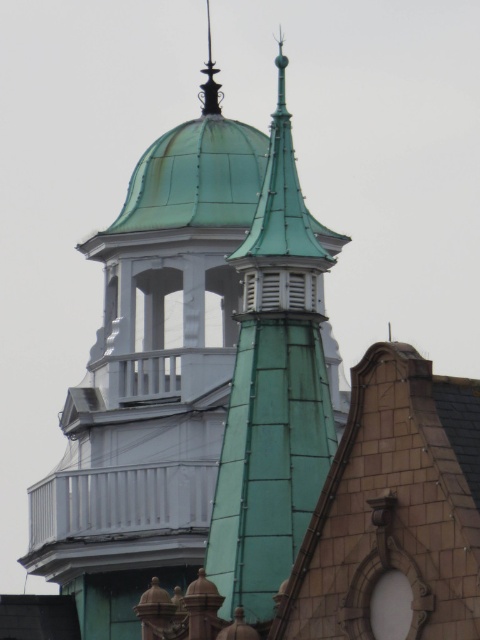
What do you see at coordinates (273, 392) in the screenshot? Image resolution: width=480 pixels, height=640 pixels. I see `green copper roof at center` at bounding box center [273, 392].

You are a GUI agent. You are given a task and a screenshot of the screen. Output one action in this format:
    pyautogui.click(x=<x>, y=<y>)
    Task: Click on the green copper roof at center
    This screenshot has height=640, width=480.
    Given the screenshot: What is the action you would take?
    pyautogui.click(x=273, y=392)

Locate an element on the screen. The image size is (480, 640). green copper roof at center is located at coordinates (273, 392).